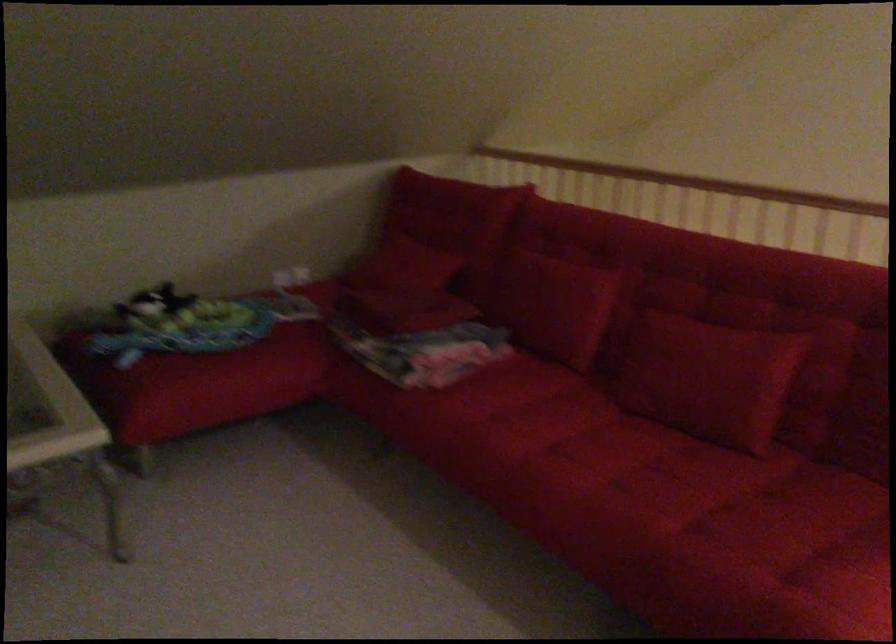
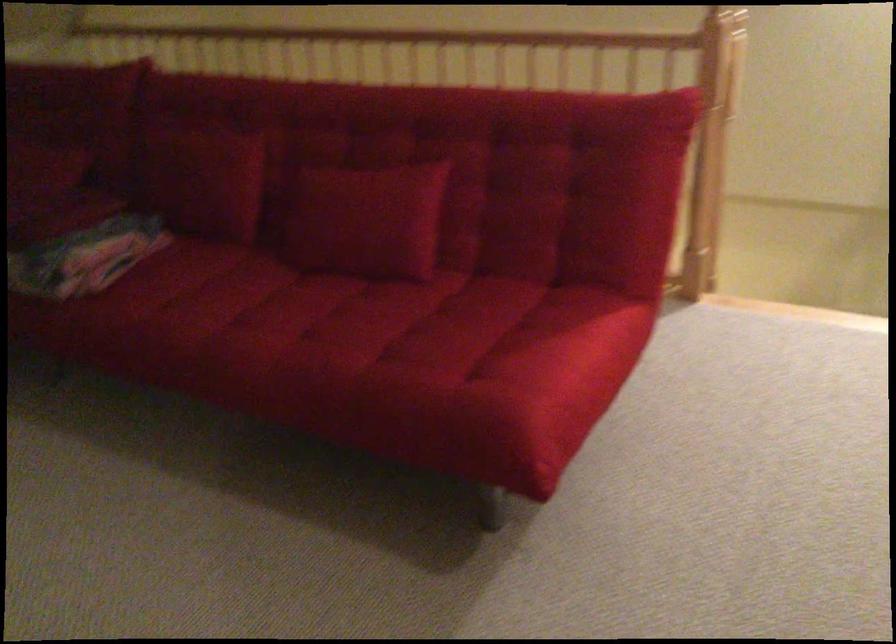
Find the pixel in the second image that matches the point at 554,287 in the first image.

(202, 176)